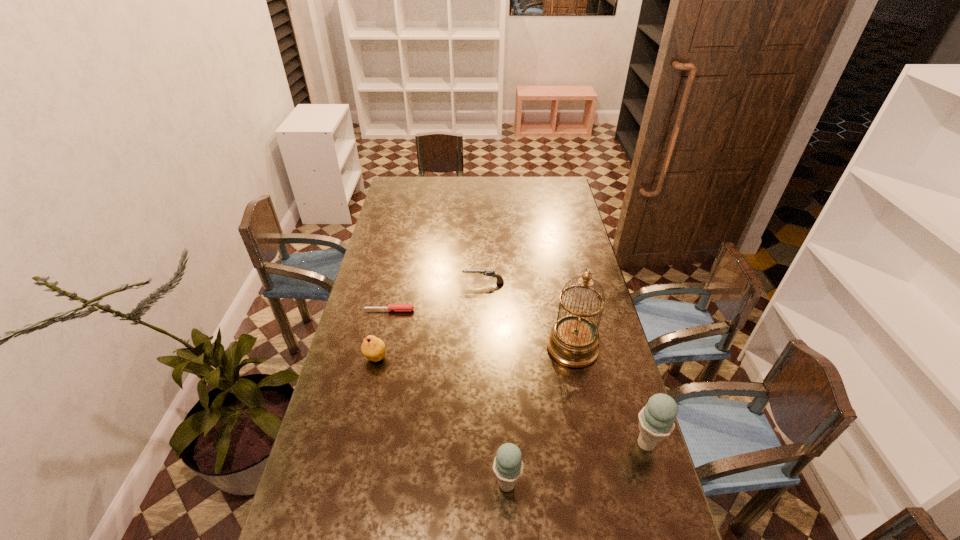
This screenshot has height=540, width=960. I want to click on the nearer ice cream, so click(x=508, y=466).

The image size is (960, 540). Find the location of `the shorter ice cream`. the shorter ice cream is located at coordinates (508, 466).

Find the location of `the taller ice cream`. the taller ice cream is located at coordinates (656, 420).

Identify the location of the rightmost object. This screenshot has width=960, height=540. (656, 420).

Where is `the second shortest object`? the second shortest object is located at coordinates (490, 273).

You are a GUI agent. You are given a task and a screenshot of the screen. Output one action in this format:
    pyautogui.click(x=<x>, y=<y>)
    Task: Click on the farthest object
    The height and width of the screenshot is (540, 960).
    Given the screenshot: What is the action you would take?
    pyautogui.click(x=490, y=273)

What are the coordinates of `pear` in the screenshot? It's located at (373, 348).

The image size is (960, 540). In order to click on birdcage in this screenshot , I will do `click(574, 340)`.

You are a GUI agent. You are given a task and a screenshot of the screen. Output one action in this format:
    pyautogui.click(x=<x>, y=<y>)
    Task: Click on the tallest object
    Image resolution: width=960 pixels, height=540 pixels.
    Given the screenshot: What is the action you would take?
    coord(574,340)

Where is `screwdriver`? The width and height of the screenshot is (960, 540). screwdriver is located at coordinates (396, 307).